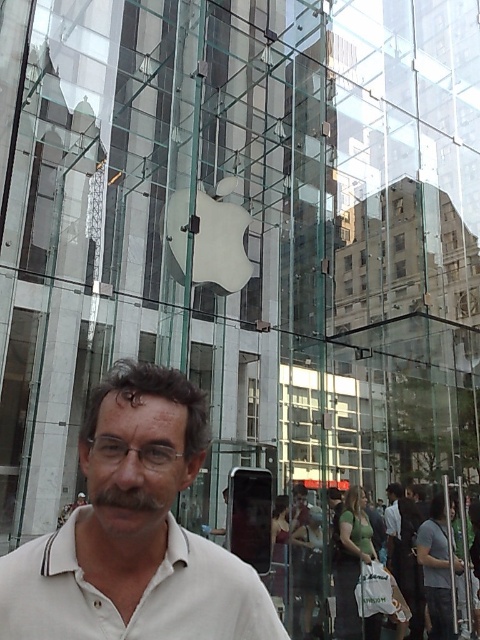
You are an architect designing a new store layout. You need to place a mannequin wearing a white matte shirt at center in the exact position where the man is standing in the image. What coordinates should you use for the mannequin?

The white matte shirt at center should be placed at coordinates (x=134, y=532) as that is the 2D location of the man in the image.